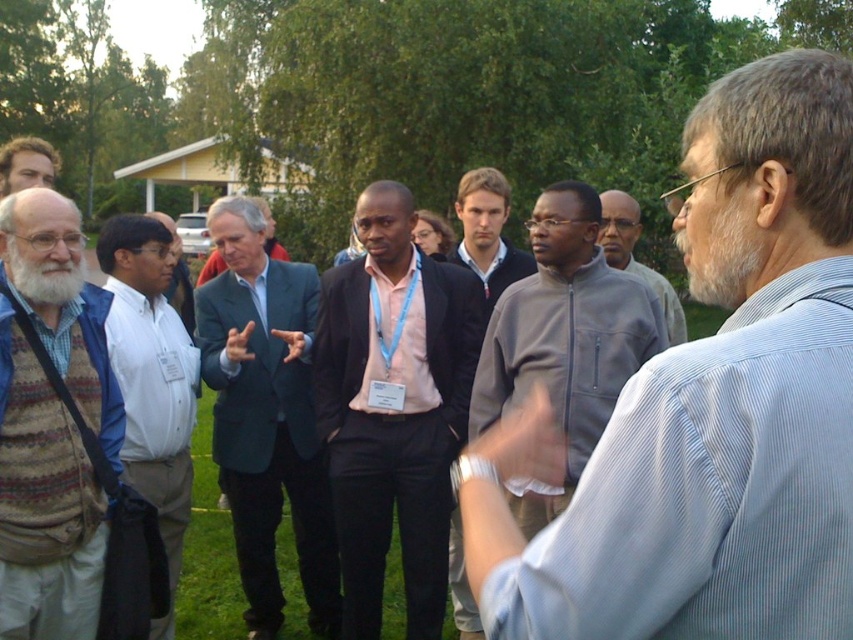
Question: Can you confirm if knitted wool vest at left is positioned to the right of matte black jacket at upper left?

Choices:
 (A) yes
 (B) no

Answer: (A)

Question: Can you confirm if white shirt at center is positioned above matte black jacket at upper left?

Choices:
 (A) yes
 (B) no

Answer: (B)

Question: Which of these objects is positioned closest to the matte black jacket at upper left?

Choices:
 (A) white shirt at center
 (B) gray fleece jacket at center
 (C) knitted wool vest at left

Answer: (C)

Question: Which of the following is the farthest from the observer?

Choices:
 (A) gray fleece jacket at center
 (B) gray zip-up jacket at center
 (C) knitted wool vest at left
 (D) gray/bearded man at center

Answer: (B)

Question: Can you confirm if white shirt at center is smaller than gray matte jacket at center?

Choices:
 (A) yes
 (B) no

Answer: (A)

Question: Which of these objects is positioned farthest from the pink fabric shirt at center?

Choices:
 (A) blue fabric suit at center
 (B) gray matte jacket at center

Answer: (B)